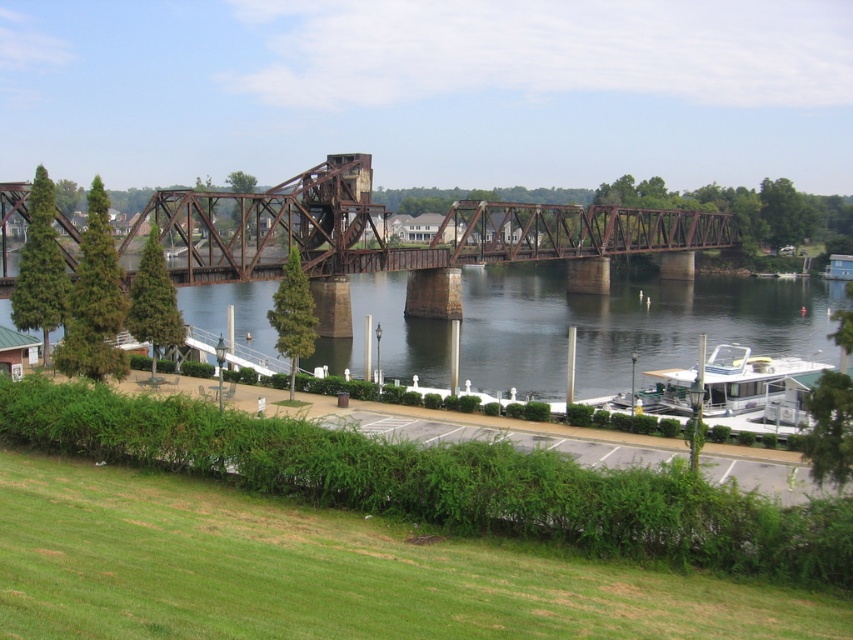
Does dark brown water at center have a greater width compared to white glossy houseboat at lower right?

Indeed, dark brown water at center has a greater width compared to white glossy houseboat at lower right.

Which is more to the left, dark brown water at center or white glossy houseboat at lower right?

dark brown water at center is more to the left.

What do you see at coordinates (627, 324) in the screenshot?
I see `dark brown water at center` at bounding box center [627, 324].

Where is `dark brown water at center`? This screenshot has height=640, width=853. dark brown water at center is located at coordinates (627, 324).

Which is more to the left, dark brown water at center or rusty metal bridge at center?

Positioned to the left is rusty metal bridge at center.

Is point (704, 276) closer to camera compared to point (480, 248)?

No, it is not.

Which is in front, point (637, 316) or point (351, 202)?

Positioned in front is point (351, 202).

Locate an element on the screen. The image size is (853, 640). dark brown water at center is located at coordinates (627, 324).

Based on the photo, does rusty metal bridge at center have a greater width compared to white glossy houseboat at lower right?

Correct, the width of rusty metal bridge at center exceeds that of white glossy houseboat at lower right.

Is rusty metal bridge at center thinner than white glossy houseboat at lower right?

In fact, rusty metal bridge at center might be wider than white glossy houseboat at lower right.

Image resolution: width=853 pixels, height=640 pixels. Describe the element at coordinates (386, 230) in the screenshot. I see `rusty metal bridge at center` at that location.

This screenshot has width=853, height=640. What are the coordinates of `rusty metal bridge at center` in the screenshot? It's located at (386, 230).